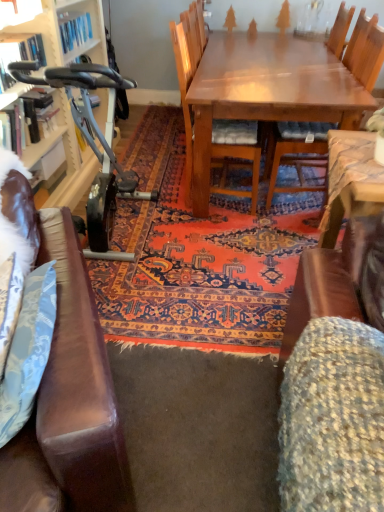
Question: From a real-world perspective, is wooden bookcase at left above or below metallic blue exercise bike at left?

Choices:
 (A) below
 (B) above

Answer: (B)

Question: Is wooden bookcase at left in front of or behind metallic blue exercise bike at left in the image?

Choices:
 (A) front
 (B) behind

Answer: (A)

Question: Considering the real-world distances, which object is farthest from the wooden bookcase at left?

Choices:
 (A) fluffy fabric swivel chair at lower right
 (B) wooden chair at center, which is the second chair from right to left
 (C) wooden chair at center, positioned as the 2th chair in left-to-right order
 (D) metallic blue exercise bike at left

Answer: (A)

Question: Which object is the farthest from the wooden chair at center, which is counted as the 1th chair, starting from the right?

Choices:
 (A) fluffy fabric swivel chair at lower right
 (B) wooden bookcase at left
 (C) wooden chair at center, which is the second chair from right to left
 (D) metallic blue exercise bike at left

Answer: (A)